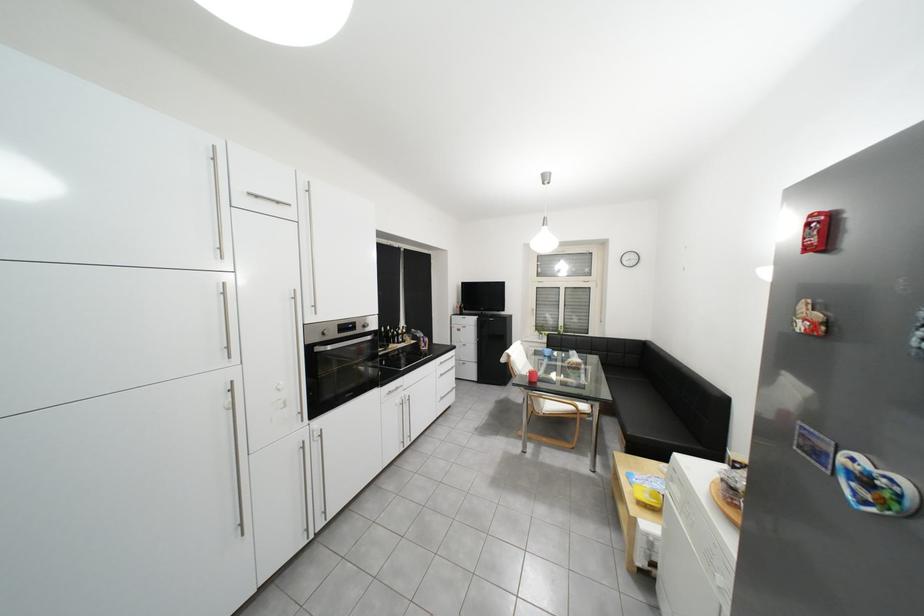
The height and width of the screenshot is (616, 924). Describe the element at coordinates (333, 326) in the screenshot. I see `the silver oven handle` at that location.